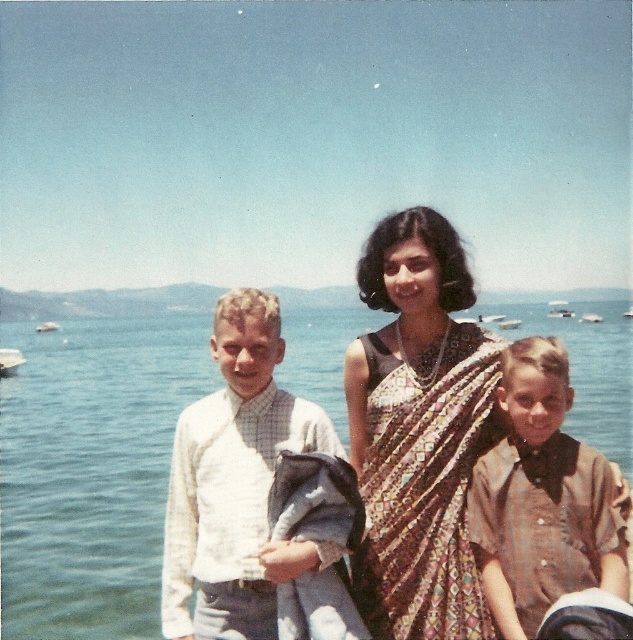
Is blue water at center thinner than white plastic boat at left?

No, blue water at center is not thinner than white plastic boat at left.

Is point (96, 403) less distant than point (35, 326)?

Yes, point (96, 403) is in front of point (35, 326).

Is point (104, 413) farther from viewer compared to point (44, 330)?

No, (104, 413) is in front of (44, 330).

Where is `blue water at center`? The height and width of the screenshot is (640, 633). blue water at center is located at coordinates (91, 468).

The image size is (633, 640). What do you see at coordinates (235, 483) in the screenshot?
I see `white cotton shirt at left` at bounding box center [235, 483].

Measure the distance between white cotton shirt at left and brown cotton shirt at lower right.

A distance of 5.48 meters exists between white cotton shirt at left and brown cotton shirt at lower right.

Which is behind, point (213, 579) or point (603, 477)?

Positioned behind is point (213, 579).

Locate an element on the screen. The width and height of the screenshot is (633, 640). white cotton shirt at left is located at coordinates (235, 483).

Which is more to the right, blue water at center or brown printed sari at center?

From the viewer's perspective, blue water at center appears more on the right side.

Which is in front, point (15, 625) or point (363, 483)?

Positioned in front is point (363, 483).

At what (x,y) coordinates should I click in order to perform the action: click on blue water at center. Please return your answer as a coordinate pair (x, y). The image size is (633, 640). Looking at the image, I should click on (91, 468).